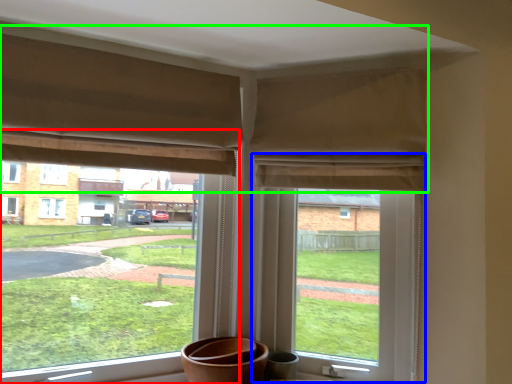
Question: Which is nearer to the window (highlighted by a red box)? window screen (highlighted by a blue box) or curtain (highlighted by a green box).

Choices:
 (A) window screen
 (B) curtain

Answer: (A)